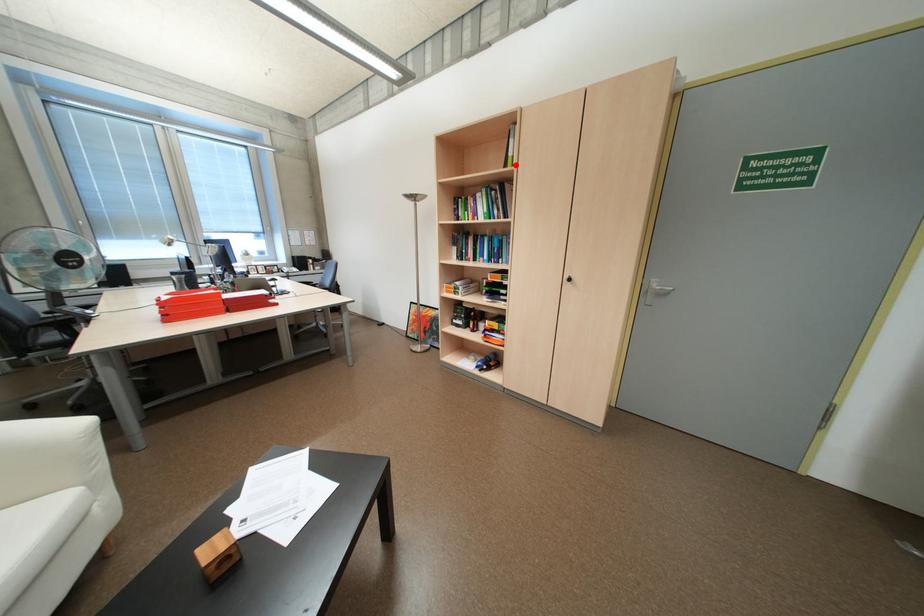
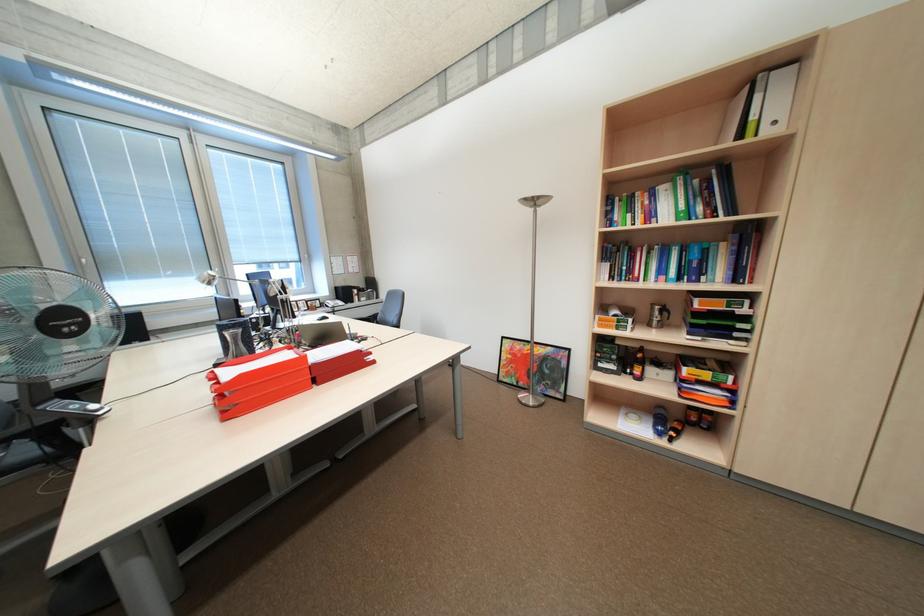
In the second image, find the point that corresponds to the highlighted location in the first image.

(749, 136)